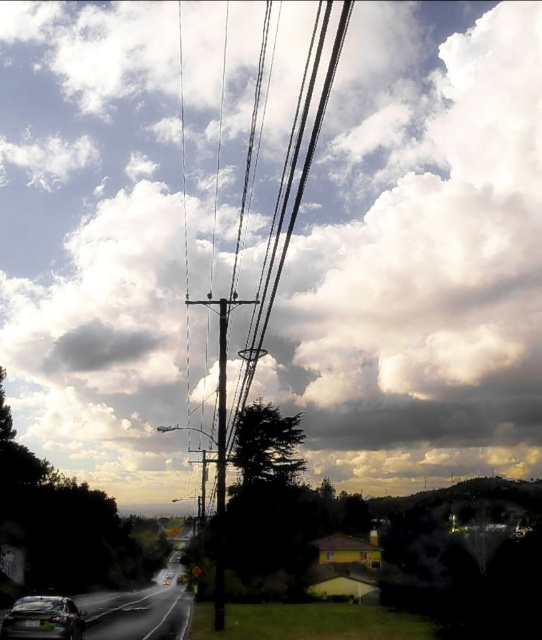
Who is positioned more to the left, smooth metallic pole at center or shiny black sedan at lower left?

shiny black sedan at lower left

Locate an element on the screen. smooth metallic pole at center is located at coordinates (221, 451).

Locate an element on the screen. smooth metallic pole at center is located at coordinates (221, 451).